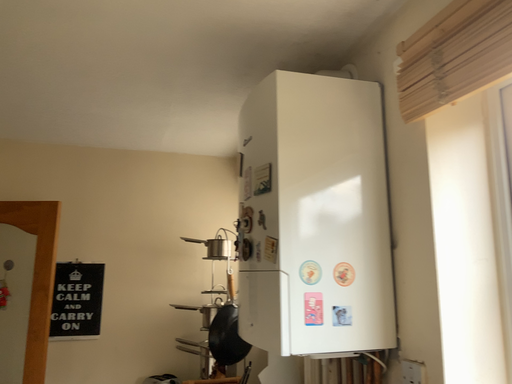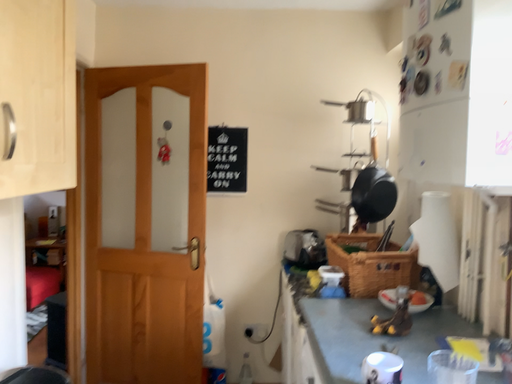
Question: Which way did the camera rotate in the video?

Choices:
 (A) rotated left
 (B) rotated right

Answer: (A)